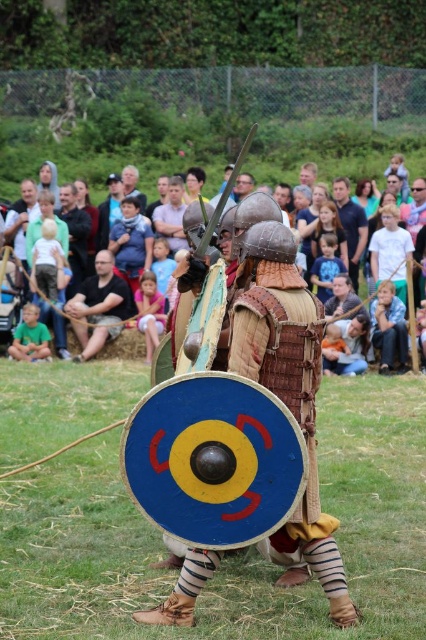
You are attending a historical reenactment festival and want to sit down to watch the mock battle between the two armored individuals. The light brown wooden bench at upper center is your only option. Can you confirm its exact location in the image using coordinates?

The light brown wooden bench at upper center is located at point (x=351, y=168).

You are a photographer at the historical reenactment. You want to take a photo of both the black leather pants at center and the brown leather armor at center. Which one should you focus on first if you want to capture them in the order they appear from left to right?

The black leather pants at center is to the left of brown leather armor at center, so you should focus on the black leather pants at center first to capture them in left to right order.

You are a costume designer analyzing the medieval attire in the image. Which piece of clothing is positioned lower on the body between the black leather pants at center and the brown leather armor at center?

The black leather pants at center is positioned below brown leather armor at center, so the black leather pants at center is lower on the body.